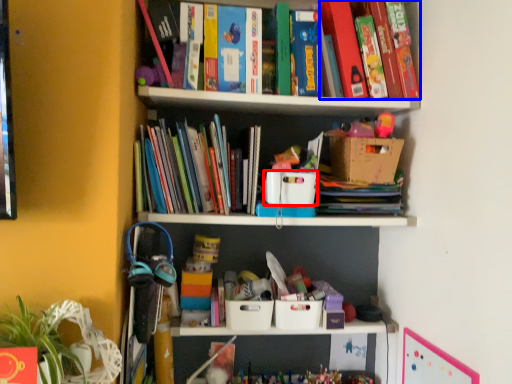
Question: Which object is closer to the camera taking this photo, storage box (highlighted by a red box) or book (highlighted by a blue box)?

Choices:
 (A) storage box
 (B) book

Answer: (A)